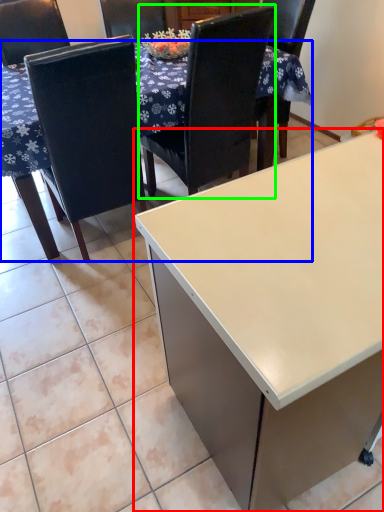
Question: Which object is positioned farthest from desk (highlighted by a red box)? Select from table (highlighted by a blue box) and chair (highlighted by a green box).

Choices:
 (A) table
 (B) chair

Answer: (A)